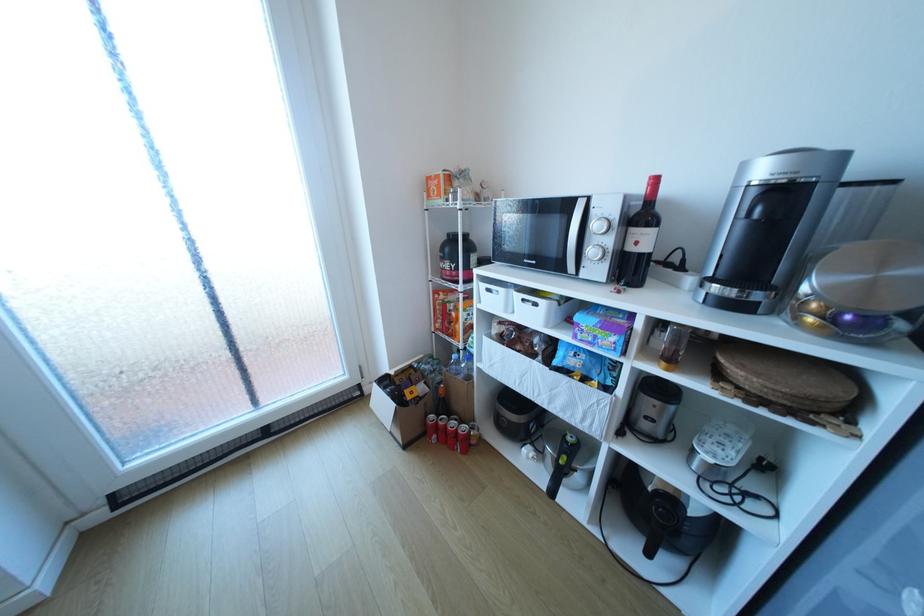
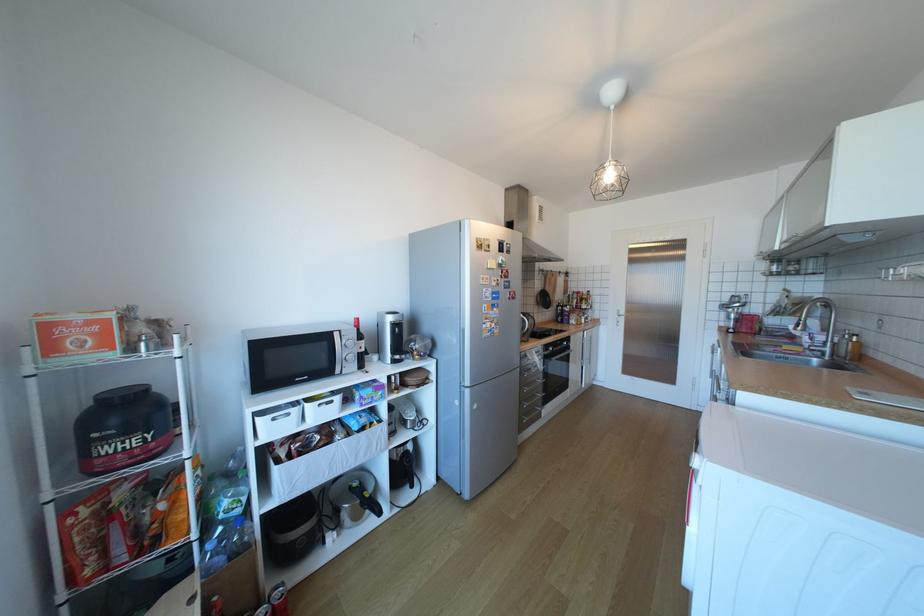
Where in the second image is the point corresponding to [565,456] from the first image?

(369, 501)